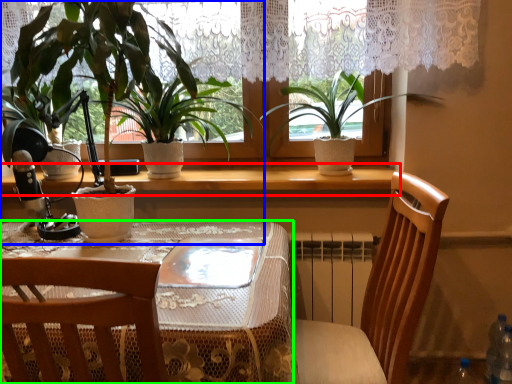
Question: Based on their relative distances, which object is nearer to window sill (highlighted by a red box)? Choose from houseplant (highlighted by a blue box) and table (highlighted by a green box).

Choices:
 (A) houseplant
 (B) table

Answer: (A)